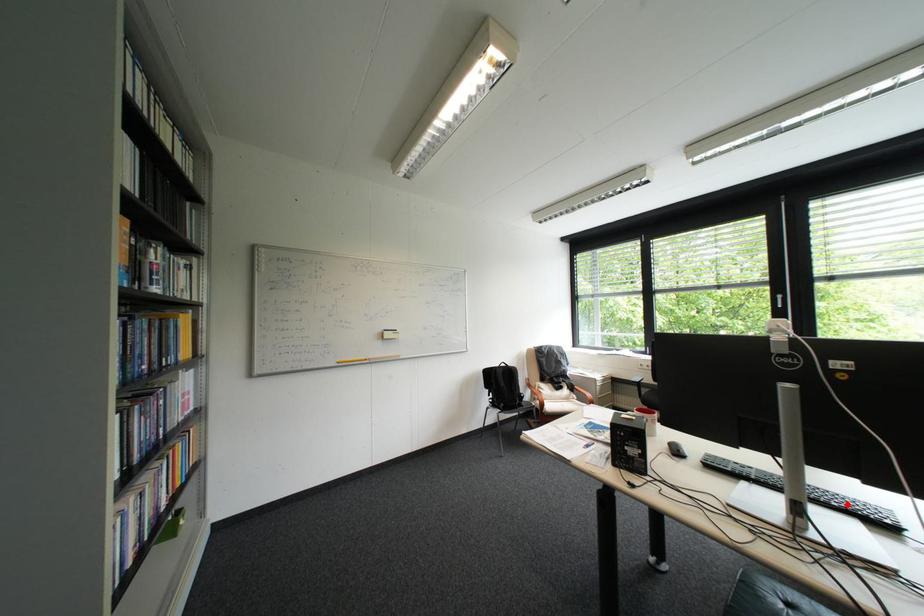
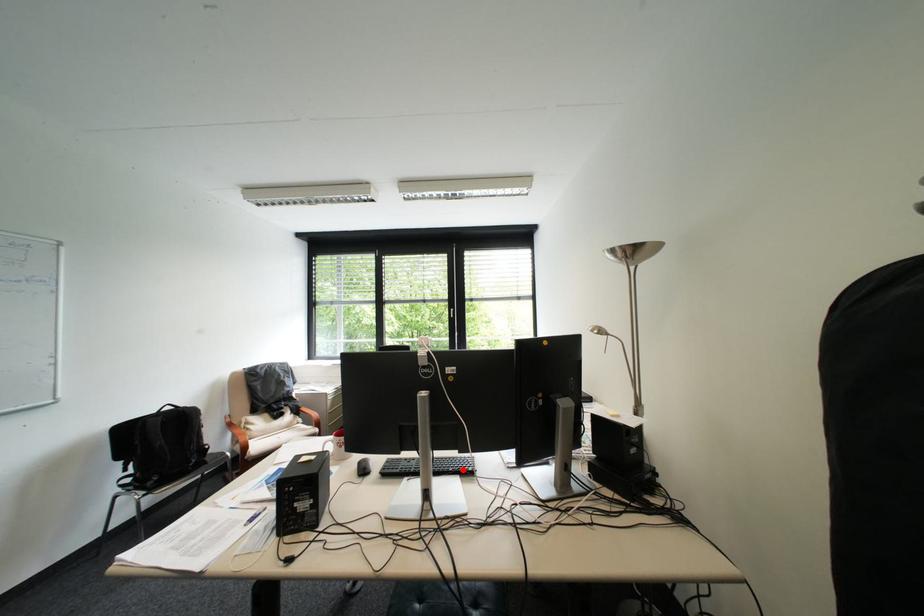
I am providing you with two images of the same scene from different viewpoints. A red point is marked on the first image and another point is marked on the second image. Does the point marked in image1 correspond to the same location as the one in image2?

Yes